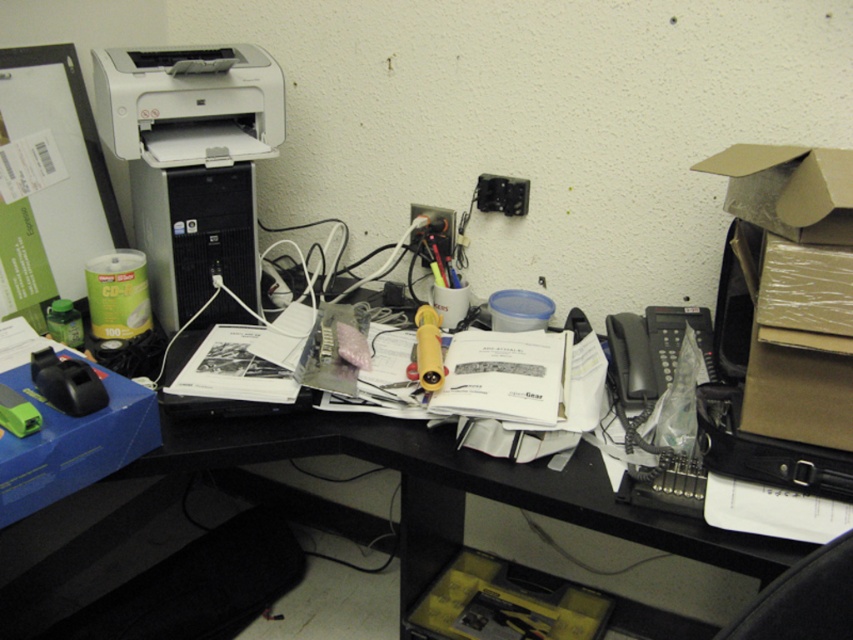
You are a delivery person who just arrived at this office. You need to place a package on the desk without moving any items. The package is 1.2 meters long. Can you fit it on the desk between the white matte printer at upper left and the edge of the desk? Please explain your reasoning.

The distance between the white matte printer at upper left and the viewer is 1.33 meters. Since the package is 1.2 meters long, it can fit as it is shorter than the available space.

Looking at the desk in the scene, which object is positioned to the left of the other between the black plastic computer at upper left and the black plastic telephone at right?

The black plastic computer at upper left is positioned to the left of the black plastic telephone at right.

You are organizing the desk and need to place a new item at coordinates point A. The white matte printer at upper left is currently at point B. Which coordinate point should you avoid placing the new item to ensure it doesn not block the printer?

You should avoid placing the new item at point B, which is the current location of the white matte printer at upper left at coordinates point B. The printer is already occupying that space, so placing another item there would block it.